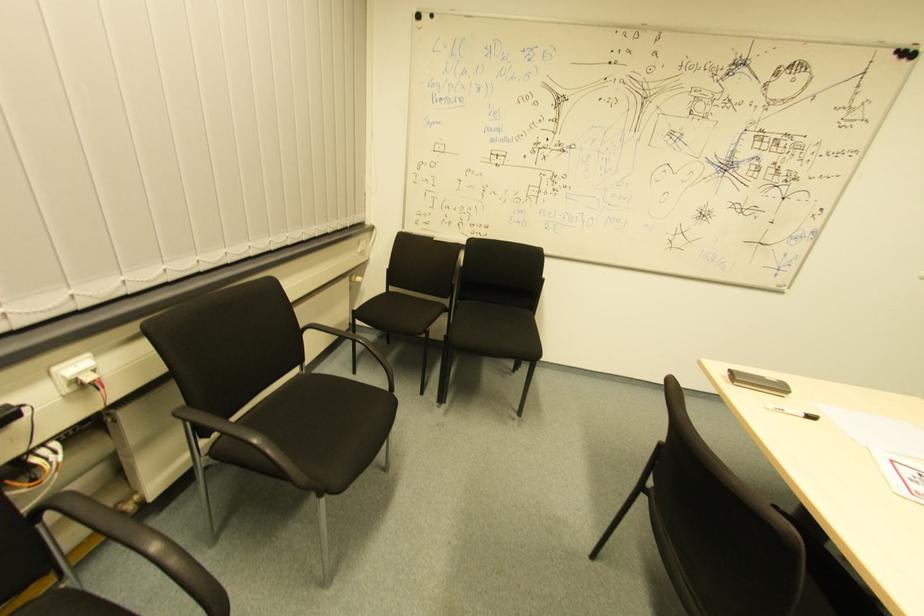
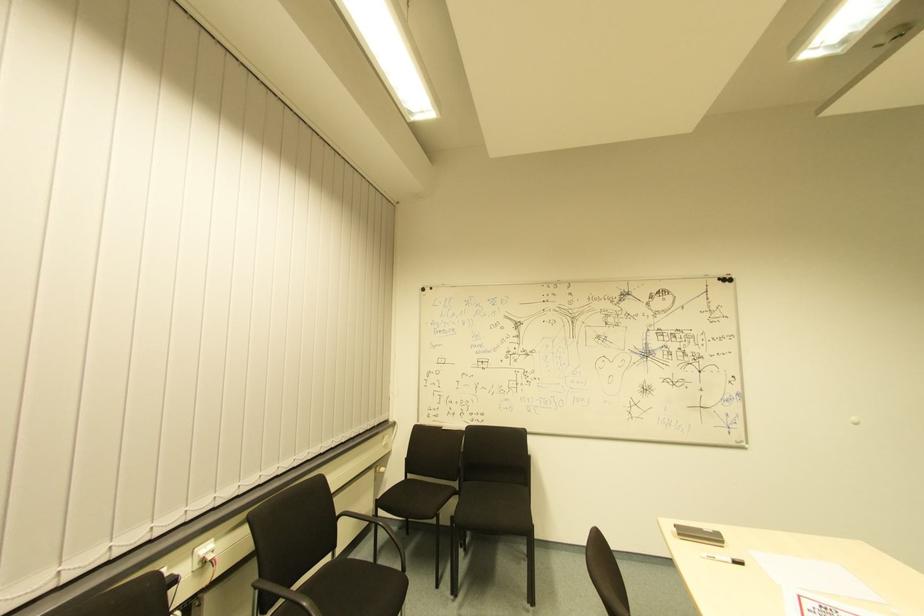
The point at (391, 292) is marked in the first image. Where is the corresponding point in the second image?

(408, 479)